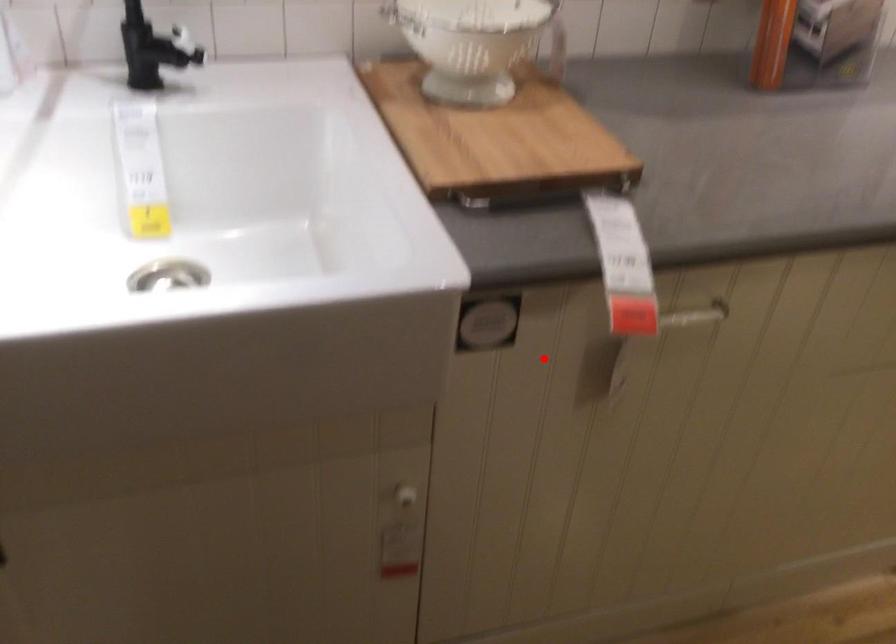
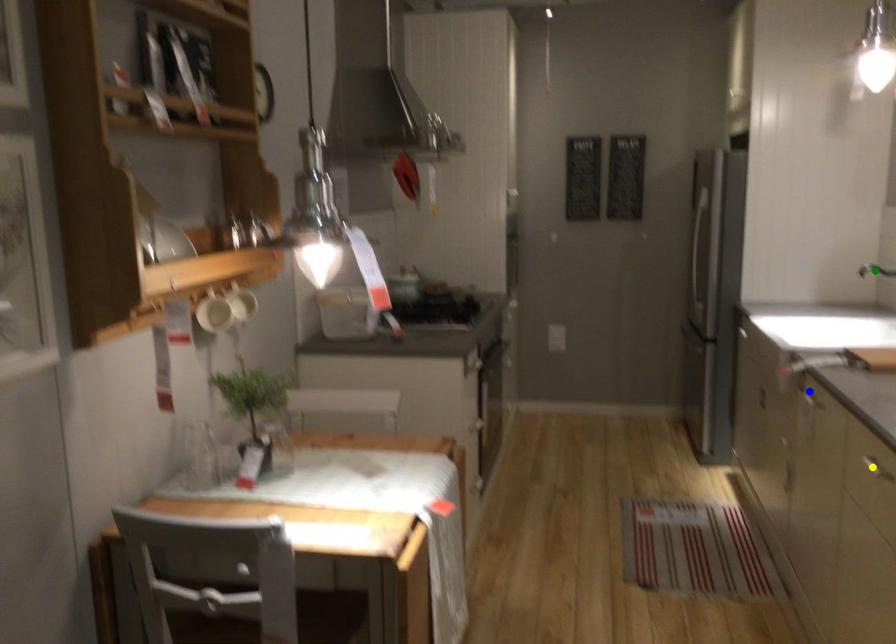
Question: I am providing you with two images of the same scene from different viewpoints. A red point is marked on the first image. You are given multiple points on the second image. Which point in image 2 is actually the same real-world point as the red point in image 1?

Choices:
 (A) green point
 (B) yellow point
 (C) blue point

Answer: (C)